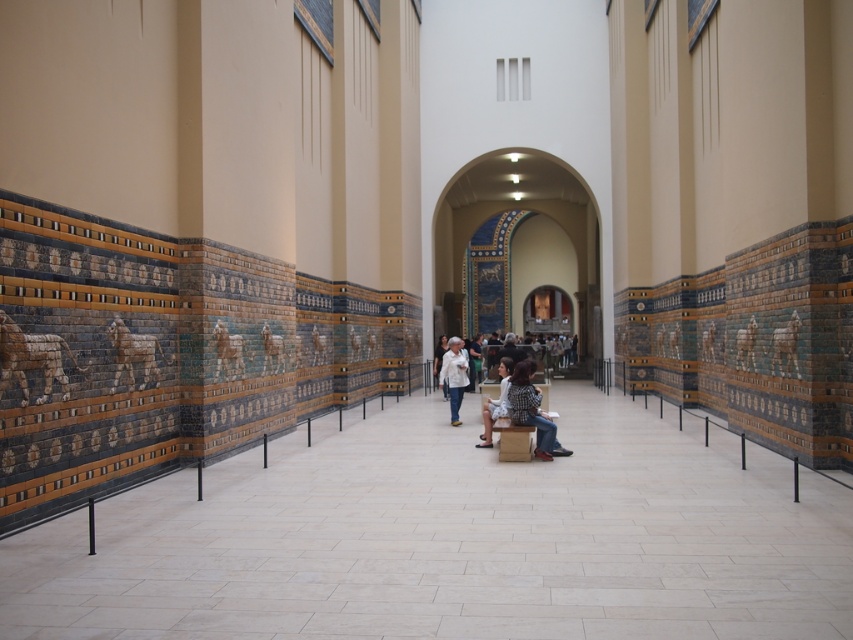
Question: Estimate the real-world distances between objects in this image. Which object is closer to the matte white shirt at center?

Choices:
 (A) white fabric dress at center
 (B) checkered shirt at center

Answer: (A)

Question: Which point is closer to the camera?

Choices:
 (A) (531, 365)
 (B) (454, 358)

Answer: (A)

Question: Which point is farther to the camera?

Choices:
 (A) checkered shirt at center
 (B) white cotton shirt at center
 (C) matte white shirt at center

Answer: (B)

Question: Is matte white shirt at center positioned in front of checkered shirt at center?

Choices:
 (A) yes
 (B) no

Answer: (B)

Question: Is matte white shirt at center further to the viewer compared to checkered shirt at center?

Choices:
 (A) no
 (B) yes

Answer: (B)

Question: Does white cotton shirt at center have a greater width compared to white fabric dress at center?

Choices:
 (A) yes
 (B) no

Answer: (B)